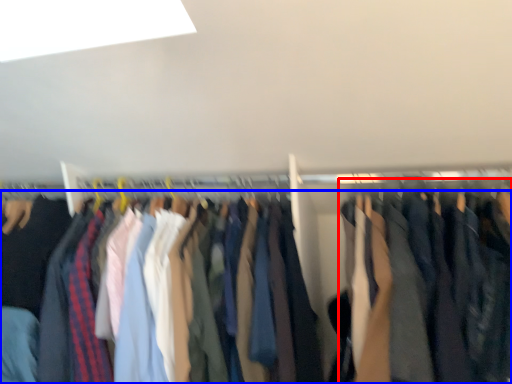
Question: Which object appears closest to the camera in this image, clothing (highlighted by a red box) or trousers (highlighted by a blue box)?

Choices:
 (A) clothing
 (B) trousers

Answer: (A)